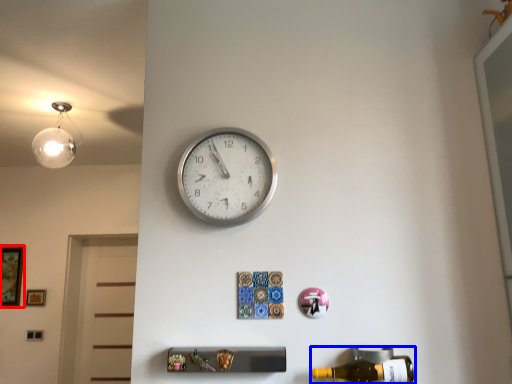
Question: Among these objects, which one is farthest to the camera, picture frame (highlighted by a red box) or beer bottle (highlighted by a blue box)?

Choices:
 (A) picture frame
 (B) beer bottle

Answer: (A)